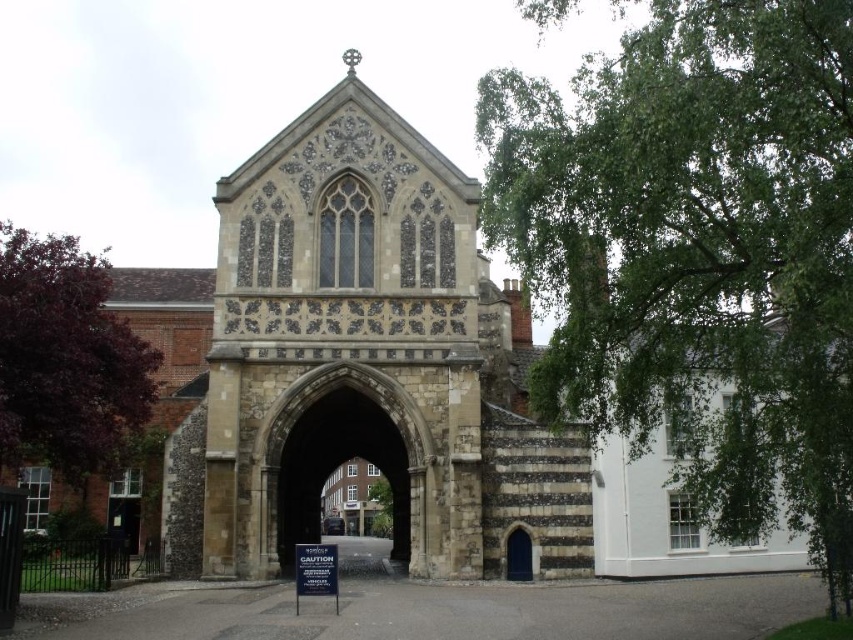
You are standing in the courtyard and want to find the tree that offers more shade. Which tree would you choose between the green leafy tree at right and the green leafy tree at center?

The green leafy tree at right is larger in size than the green leafy tree at center, so it would provide more shade.

You are standing in the courtyard and want to take a photo of the stone archway at center. However, the green leafy tree at right is blocking your view. Can you move to the left to get a clear shot without the tree in the frame?

The green leafy tree at right is in front of the stone archway at center, so moving to the left might help you position yourself where the tree no longer blocks the view of the archway.

You are standing in front of the historic stone archway and want to reach the white building with large windows to your right. There is a green leafy tree at right blocking your path. Can you walk around the tree to reach the building?

The green leafy tree at right is 52.06 meters from viewer, so you can easily walk around it to reach the white building with large windows to your right.